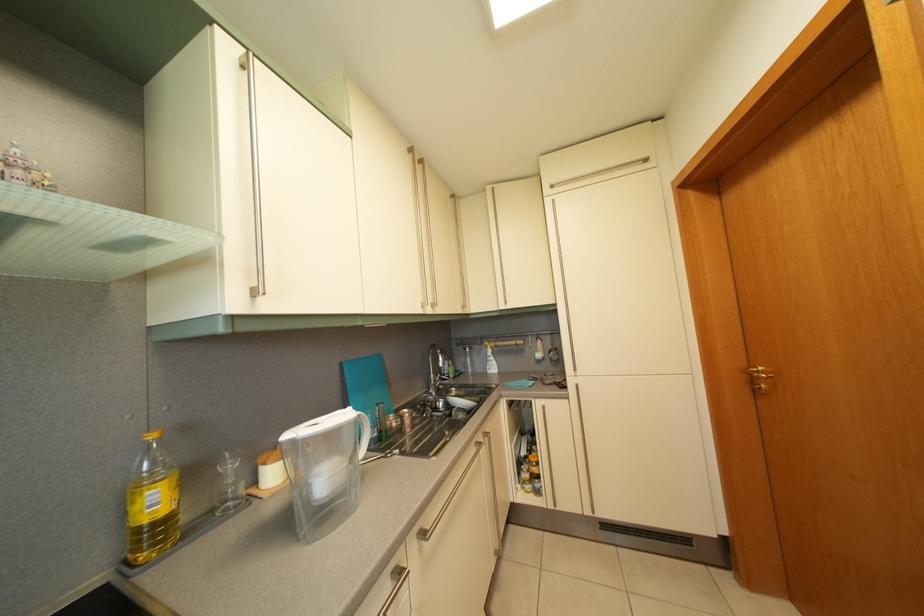
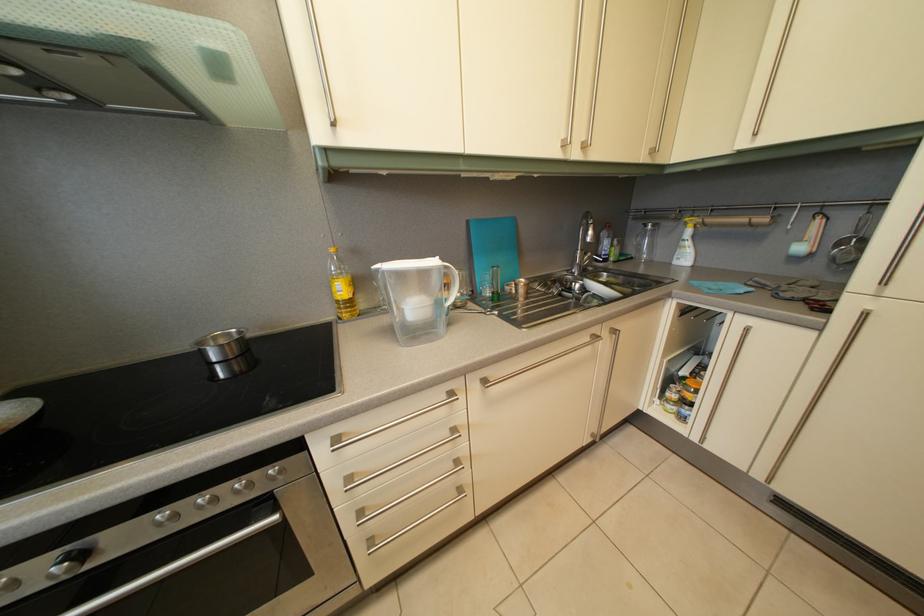
First-person continuous shooting, in which direction is the camera rotating?

The rotation direction of the camera is left-down.